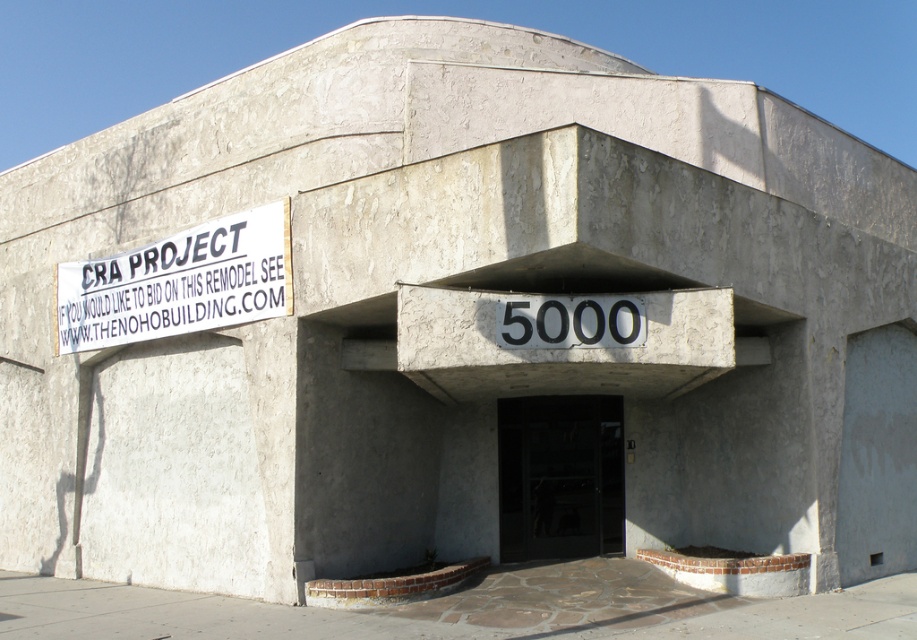
Is gray concrete at lower center smaller than black glass door at center?

No.

Is gray concrete at lower center above black glass door at center?

Incorrect, gray concrete at lower center is not positioned above black glass door at center.

Is point (43, 611) positioned before point (540, 416)?

Yes, it is.

The image size is (917, 640). What are the coordinates of `gray concrete at lower center` in the screenshot? It's located at (468, 609).

Is white paper sign at upper left taller than black glass door at center?

No, white paper sign at upper left is not taller than black glass door at center.

Between white paper sign at upper left and black glass door at center, which one appears on the right side from the viewer's perspective?

Positioned to the right is black glass door at center.

Locate an element on the screen. The image size is (917, 640). white paper sign at upper left is located at coordinates (177, 282).

At what (x,y) coordinates should I click in order to perform the action: click on white paper sign at upper left. Please return your answer as a coordinate pair (x, y). The image size is (917, 640). Looking at the image, I should click on (177, 282).

Is point (273, 618) more distant than point (84, 288)?

No, (273, 618) is closer to viewer.

In the scene shown: Is gray concrete at lower center below white paper sign at upper left?

Indeed, gray concrete at lower center is positioned under white paper sign at upper left.

Who is more forward, (x=782, y=624) or (x=219, y=272)?

Point (x=782, y=624) is more forward.

At what (x,y) coordinates should I click in order to perform the action: click on gray concrete at lower center. Please return your answer as a coordinate pair (x, y). The height and width of the screenshot is (640, 917). Looking at the image, I should click on (468, 609).